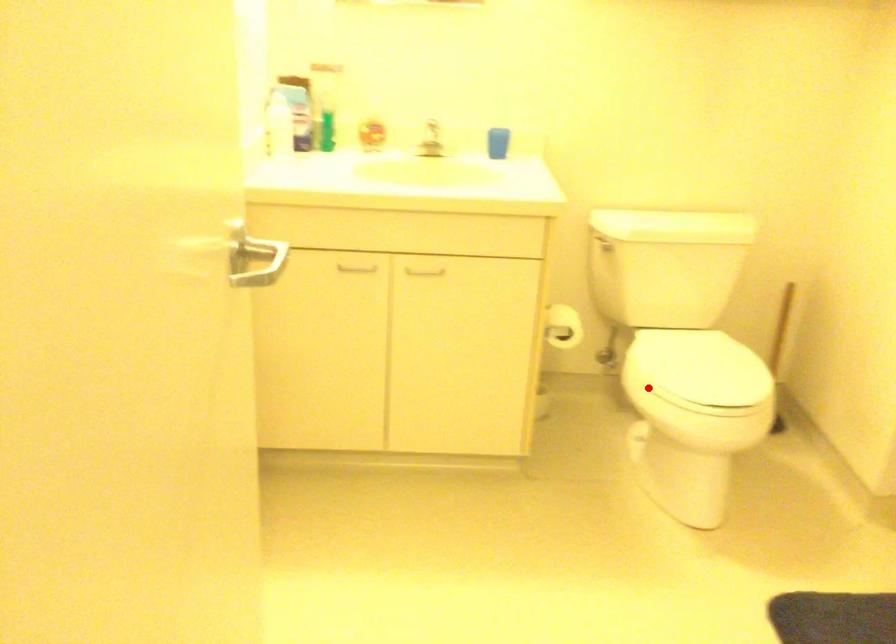
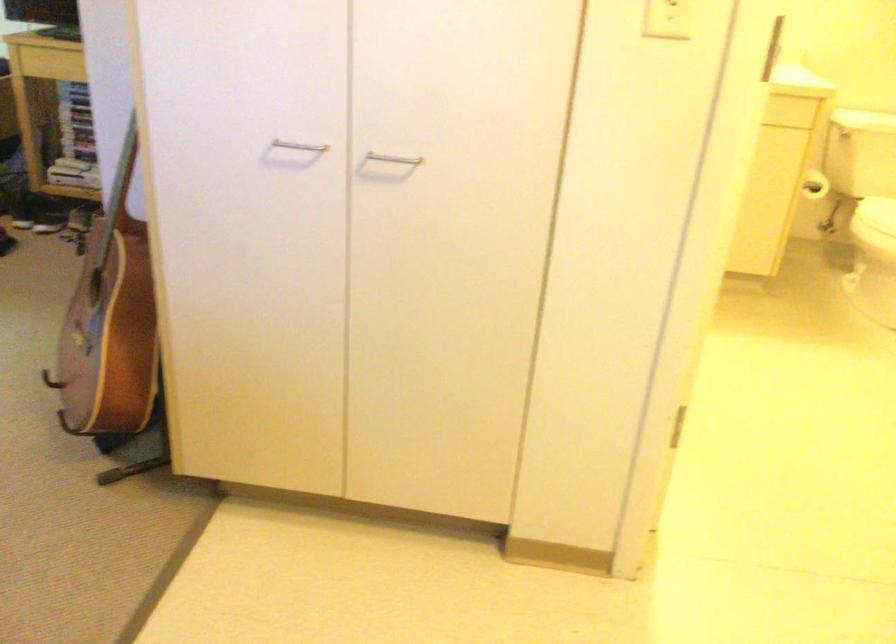
The point at the highlighted location is marked in the first image. Where is the corresponding point in the second image?

(876, 214)